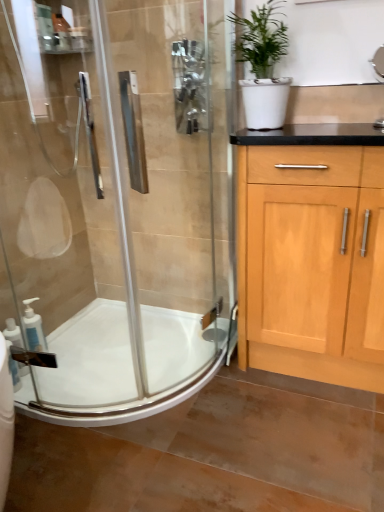
Locate an element on the screen. The image size is (384, 512). free space to the right of white glossy soap dispenser at lower left, placed as the 1th soap dispenser when sorted from front to back is located at coordinates (63, 376).